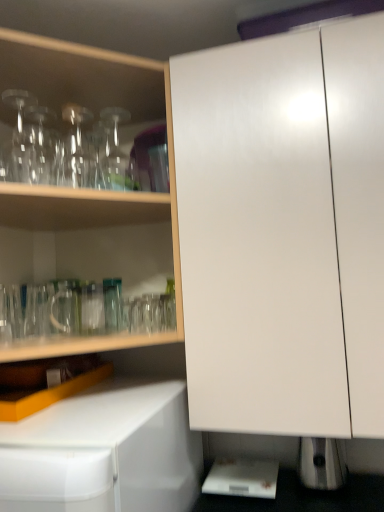
Question: From the image's perspective, is transparent glass bottle at upper left, which is the 1th bottle in right-to-left order, above transparent glassware at upper left, arranged as the first cabinetry when viewed from the left?

Choices:
 (A) yes
 (B) no

Answer: (A)

Question: Considering the relative sizes of transparent glass bottle at upper left, acting as the second bottle starting from the left, and transparent glassware at upper left, marked as the 2th cabinetry in a right-to-left arrangement, in the image provided, is transparent glass bottle at upper left, acting as the second bottle starting from the left, taller than transparent glassware at upper left, marked as the 2th cabinetry in a right-to-left arrangement,?

Choices:
 (A) yes
 (B) no

Answer: (B)

Question: From a real-world perspective, is transparent glass bottle at upper left, acting as the second bottle starting from the left, located beneath transparent glassware at upper left, arranged as the first cabinetry when viewed from the left?

Choices:
 (A) yes
 (B) no

Answer: (B)

Question: Can we say transparent glass bottle at upper left, which is the 1th bottle in right-to-left order, lies outside transparent glassware at upper left, arranged as the first cabinetry when viewed from the left?

Choices:
 (A) no
 (B) yes

Answer: (A)

Question: Considering the relative sizes of transparent glass bottle at upper left, acting as the second bottle starting from the left, and transparent glassware at upper left, arranged as the first cabinetry when viewed from the left, in the image provided, is transparent glass bottle at upper left, acting as the second bottle starting from the left, wider than transparent glassware at upper left, arranged as the first cabinetry when viewed from the left,?

Choices:
 (A) no
 (B) yes

Answer: (A)

Question: Does point (327, 425) appear closer or farther from the camera than point (115, 116)?

Choices:
 (A) farther
 (B) closer

Answer: (B)

Question: Based on their positions, is white glossy cabinet at center, marked as the second cabinetry in a left-to-right arrangement, located to the left or right of transparent glass bottle at upper left, which is the 1th bottle in right-to-left order?

Choices:
 (A) left
 (B) right

Answer: (B)

Question: Considering their positions, is white glossy cabinet at center, marked as the second cabinetry in a left-to-right arrangement, located in front of or behind transparent glass bottle at upper left, acting as the second bottle starting from the left?

Choices:
 (A) front
 (B) behind

Answer: (A)

Question: Considering the positions of white glossy cabinet at center, which appears as the 1th cabinetry when viewed from the right, and transparent glass bottle at upper left, which is the 1th bottle in right-to-left order, in the image, is white glossy cabinet at center, which appears as the 1th cabinetry when viewed from the right, wider or thinner than transparent glass bottle at upper left, which is the 1th bottle in right-to-left order,?

Choices:
 (A) thin
 (B) wide

Answer: (B)

Question: Is transparent glass bottle at upper left, acting as the second bottle starting from the left, wider or thinner than white glossy cabinet at center, which appears as the 1th cabinetry when viewed from the right?

Choices:
 (A) thin
 (B) wide

Answer: (A)

Question: Is transparent glass bottle at upper left, acting as the second bottle starting from the left, in front of or behind white glossy cabinet at center, marked as the second cabinetry in a left-to-right arrangement, in the image?

Choices:
 (A) front
 (B) behind

Answer: (B)

Question: Considering the positions of point (110, 161) and point (370, 244), is point (110, 161) closer or farther from the camera than point (370, 244)?

Choices:
 (A) farther
 (B) closer

Answer: (A)

Question: Do you think transparent glass bottle at upper left, which is the 1th bottle in right-to-left order, is within white glossy cabinet at center, which appears as the 1th cabinetry when viewed from the right, or outside of it?

Choices:
 (A) outside
 (B) inside

Answer: (A)

Question: In terms of height, does transparent glass bottle at upper left, which is the 1th bottle in right-to-left order, look taller or shorter compared to transparent glass bottle at upper left, acting as the second bottle starting from the right?

Choices:
 (A) tall
 (B) short

Answer: (B)

Question: Is transparent glass bottle at upper left, which is the 1th bottle in right-to-left order, situated inside transparent glass bottle at upper left, acting as the second bottle starting from the right, or outside?

Choices:
 (A) outside
 (B) inside

Answer: (A)